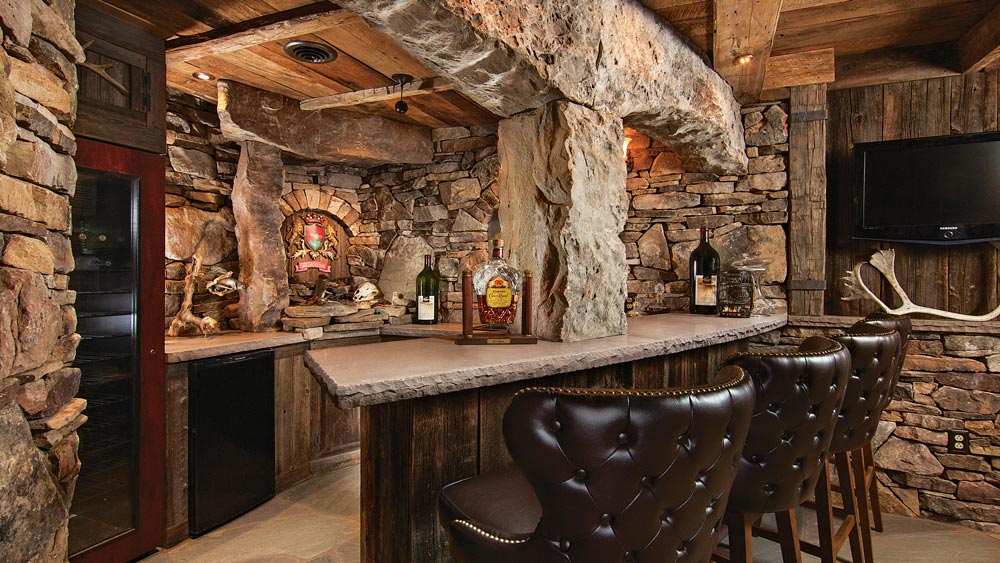
Find the location of a particular element. The image size is (1000, 563). chairs is located at coordinates (614, 440), (807, 425), (864, 373).